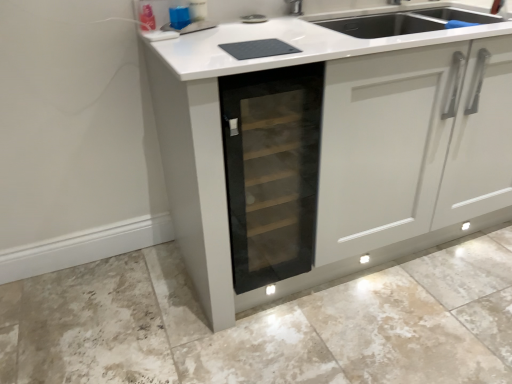
Question: Considering the relative positions of matte gray granite at lower center and transparent glass wine cooler at center in the image provided, is matte gray granite at lower center to the left or to the right of transparent glass wine cooler at center?

Choices:
 (A) right
 (B) left

Answer: (A)

Question: Is matte gray granite at lower center inside or outside of transparent glass wine cooler at center?

Choices:
 (A) inside
 (B) outside

Answer: (B)

Question: From the image's perspective, relative to transparent glass wine cooler at center, is matte gray granite at lower center above or below?

Choices:
 (A) below
 (B) above

Answer: (A)

Question: From a real-world perspective, relative to matte gray granite at lower center, is transparent glass wine cooler at center vertically above or below?

Choices:
 (A) above
 (B) below

Answer: (A)

Question: Is transparent glass wine cooler at center wider or thinner than matte gray granite at lower center?

Choices:
 (A) thin
 (B) wide

Answer: (A)

Question: Does point (274, 117) appear closer or farther from the camera than point (313, 324)?

Choices:
 (A) farther
 (B) closer

Answer: (B)

Question: Would you say transparent glass wine cooler at center is inside or outside matte gray granite at lower center?

Choices:
 (A) inside
 (B) outside

Answer: (B)